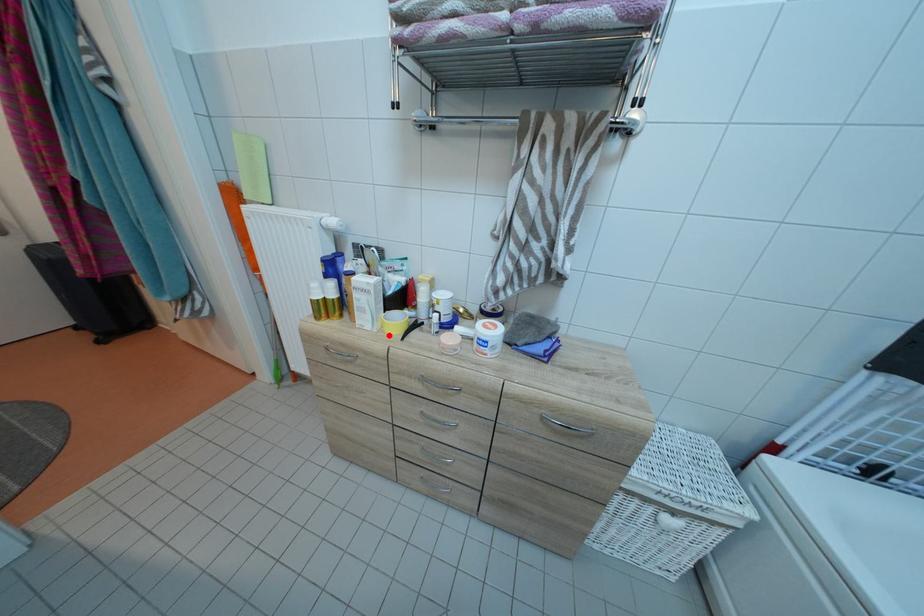
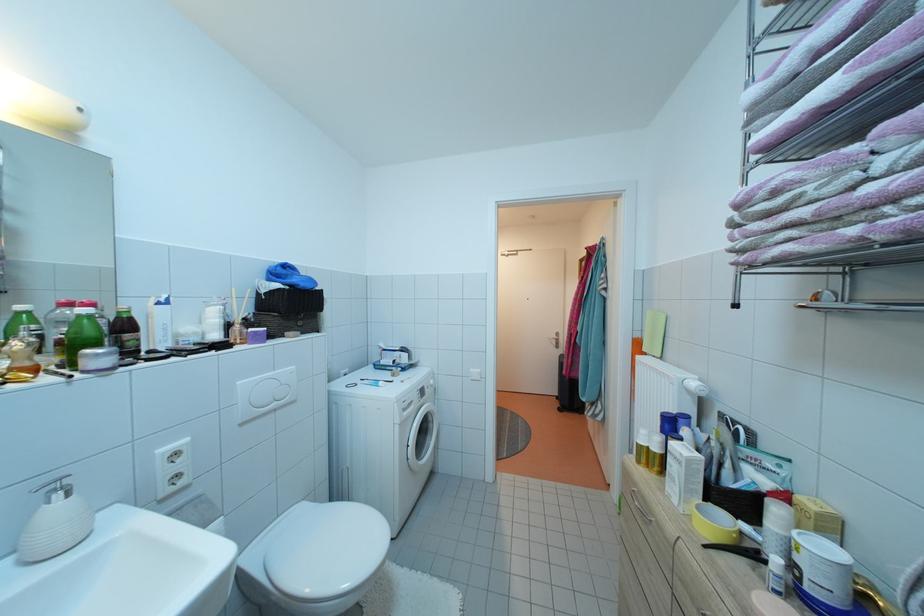
Find the pixel in the second image that matches the highlighted location in the first image.

(697, 523)